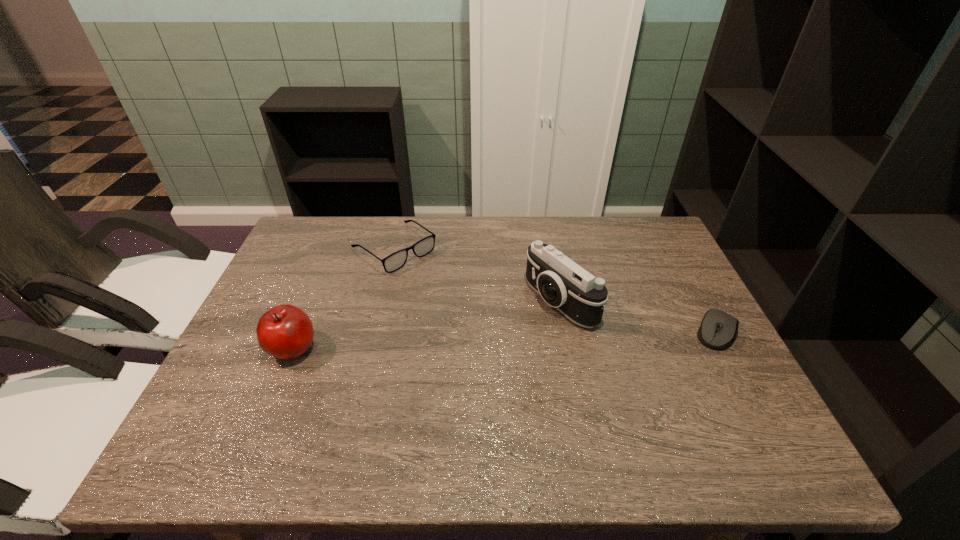
I want to click on vacant area situated 0.110m on the front-facing side of the spectacles, so click(x=444, y=287).

Locate an element on the screen. free spot located 0.120m on the front-facing side of the spectacles is located at coordinates (446, 289).

The image size is (960, 540). I want to click on vacant area situated on the front-facing side of the spectacles, so click(442, 286).

At what (x,y) coordinates should I click in order to perform the action: click on object positioned at the far edge. Please return your answer as a coordinate pair (x, y). The image size is (960, 540). Looking at the image, I should click on (395, 261).

The width and height of the screenshot is (960, 540). Identify the location of object present at the left edge. (286, 332).

Locate an element on the screen. The width and height of the screenshot is (960, 540). object present at the right edge is located at coordinates (718, 330).

Where is `vacant space at the far edge`? Image resolution: width=960 pixels, height=540 pixels. vacant space at the far edge is located at coordinates (483, 219).

In the image, there is a desktop. Where is `vacant space at the left edge`? The image size is (960, 540). vacant space at the left edge is located at coordinates (274, 283).

You are a GUI agent. You are given a task and a screenshot of the screen. Output one action in this format:
    pyautogui.click(x=<x>, y=<y>)
    Task: Click on the vacant space at the right edge of the desktop
    
    Given the screenshot: What is the action you would take?
    click(676, 317)

In the image, there is a desktop. Identify the location of vacant space at the far left corner. tap(347, 232).